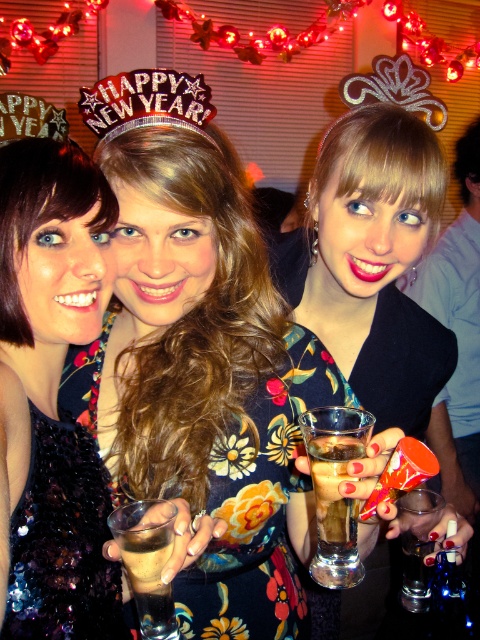
Measure the distance between point [141,456] and camera.

A distance of 28.11 inches exists between point [141,456] and camera.

Can you confirm if shiny sequin dress at center is positioned above glittery gold crown at upper center?

No.

You are a GUI agent. You are given a task and a screenshot of the screen. Output one action in this format:
    pyautogui.click(x=<x>, y=<y>)
    Task: Click on the shiny sequin dress at center
    
    Given the screenshot: What is the action you would take?
    pyautogui.click(x=199, y=355)

Between shiny sequin dress at center and translucent glass at center, which one has more height?

shiny sequin dress at center is taller.

Based on the photo, is shiny sequin dress at center to the left of translucent glass at center from the viewer's perspective?

No, shiny sequin dress at center is not to the left of translucent glass at center.

Who is more distant from viewer, (164, 276) or (159, 608)?

Point (164, 276)

Find the location of `shiny sequin dress at center`. shiny sequin dress at center is located at coordinates (199, 355).

Who is positioned more to the left, matte black dress at center or pink glittery tiara at center?

pink glittery tiara at center

Does matte black dress at center have a larger size compared to pink glittery tiara at center?

Yes, matte black dress at center is bigger than pink glittery tiara at center.

Image resolution: width=480 pixels, height=640 pixels. Describe the element at coordinates (372, 260) in the screenshot. I see `matte black dress at center` at that location.

This screenshot has width=480, height=640. Identify the location of matte black dress at center. (372, 260).